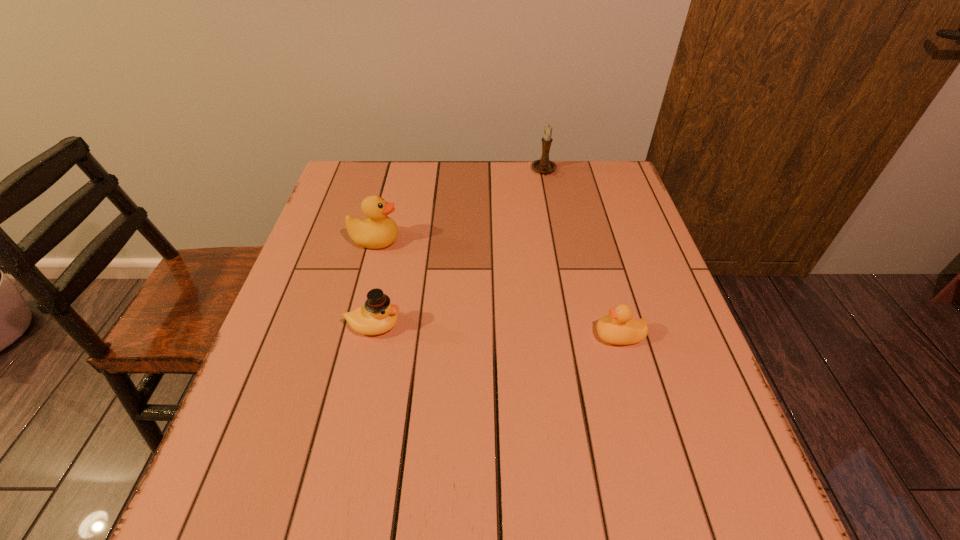
Locate an element on the screen. Image resolution: width=960 pixels, height=540 pixels. object at the far edge is located at coordinates (544, 165).

Find the location of a particular element. object located at the right edge is located at coordinates (619, 328).

You are a GUI agent. You are given a task and a screenshot of the screen. Output one action in this format:
    pyautogui.click(x=<x>, y=<y>)
    Task: Click on the vacant area at the far edge
    
    Given the screenshot: What is the action you would take?
    pyautogui.click(x=472, y=177)

Where is `vacant space at the near edge of the desktop`? vacant space at the near edge of the desktop is located at coordinates (569, 484).

Where is `free region at the left edge`? The width and height of the screenshot is (960, 540). free region at the left edge is located at coordinates 306,335.

Identify the location of vacant region at the right edge of the desktop. (653, 353).

Find the location of a particular element. empty space that is in between the third object from left to right and the farthest duck is located at coordinates (460, 206).

Find the location of a particular element. vacant area that lies between the farthest object and the rightmost duck is located at coordinates [582, 253].

Where is `empty location between the tallest duck and the rightmost object`? This screenshot has height=540, width=960. empty location between the tallest duck and the rightmost object is located at coordinates (497, 288).

Image resolution: width=960 pixels, height=540 pixels. I want to click on free spot between the farthest object and the rightmost object, so click(x=582, y=253).